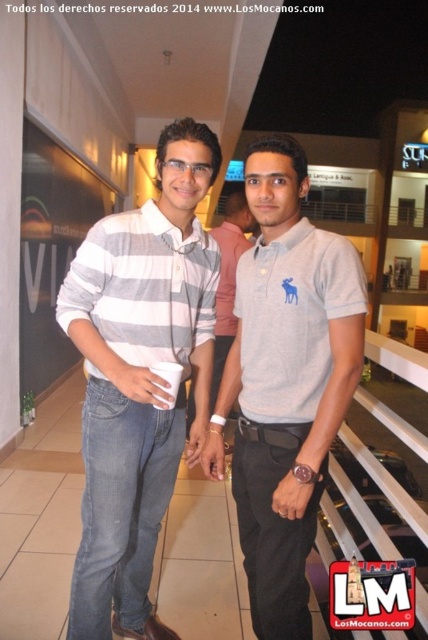
Question: Is gray striped polo shirt at left smaller than gray cotton polo shirt at center?

Choices:
 (A) yes
 (B) no

Answer: (B)

Question: Does gray cotton polo shirt at center appear over gray striped polo shirt at center?

Choices:
 (A) no
 (B) yes

Answer: (A)

Question: Which of these objects is positioned farthest from the gray cotton polo shirt at center?

Choices:
 (A) gray striped polo shirt at left
 (B) gray striped polo shirt at center

Answer: (B)

Question: Which of the following is the farthest from the observer?

Choices:
 (A) gray striped polo shirt at left
 (B) gray striped polo shirt at center

Answer: (B)

Question: Is gray striped polo shirt at left further to camera compared to gray striped polo shirt at center?

Choices:
 (A) no
 (B) yes

Answer: (A)

Question: Which is farther from the gray striped polo shirt at center?

Choices:
 (A) gray cotton polo shirt at center
 (B) gray striped polo shirt at left

Answer: (A)